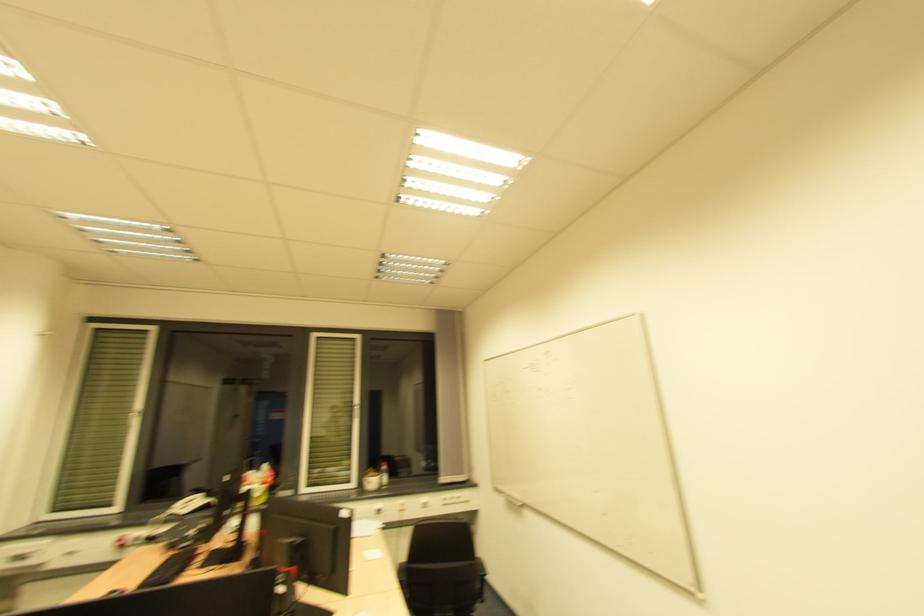
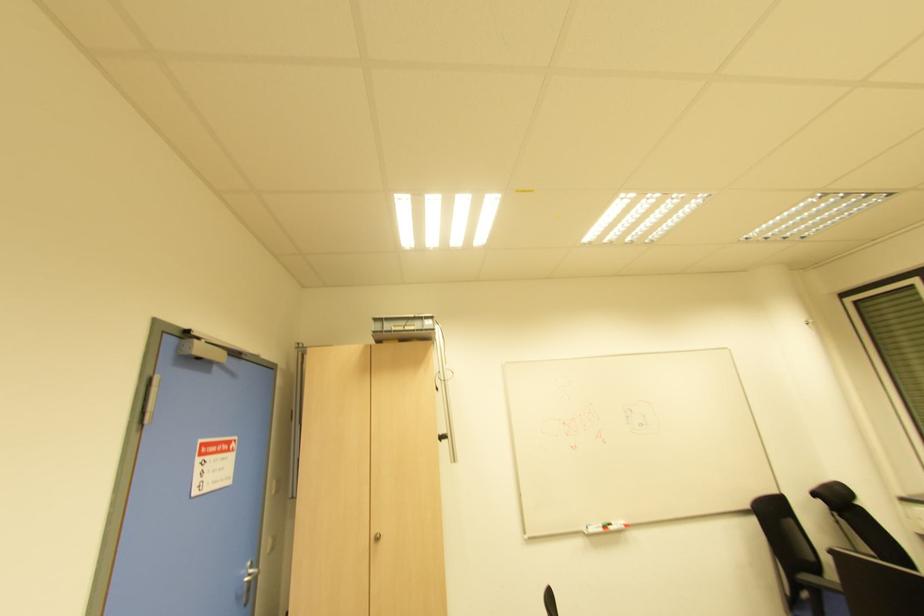
How did the camera likely rotate?

The rotation direction of the camera is left-up.